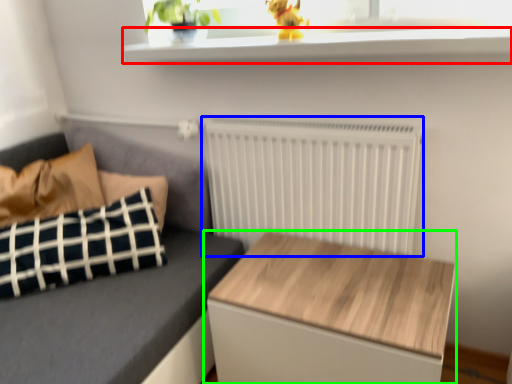
Question: Estimate the real-world distances between objects in this image. Which object is closer to window sill (highlighted by a red box), radiator (highlighted by a blue box) or table (highlighted by a green box)?

Choices:
 (A) radiator
 (B) table

Answer: (A)